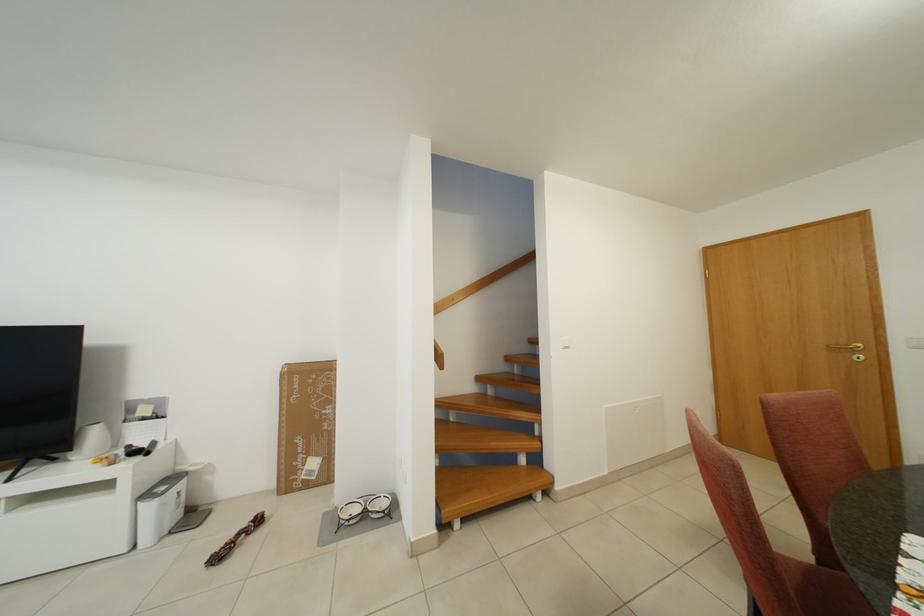
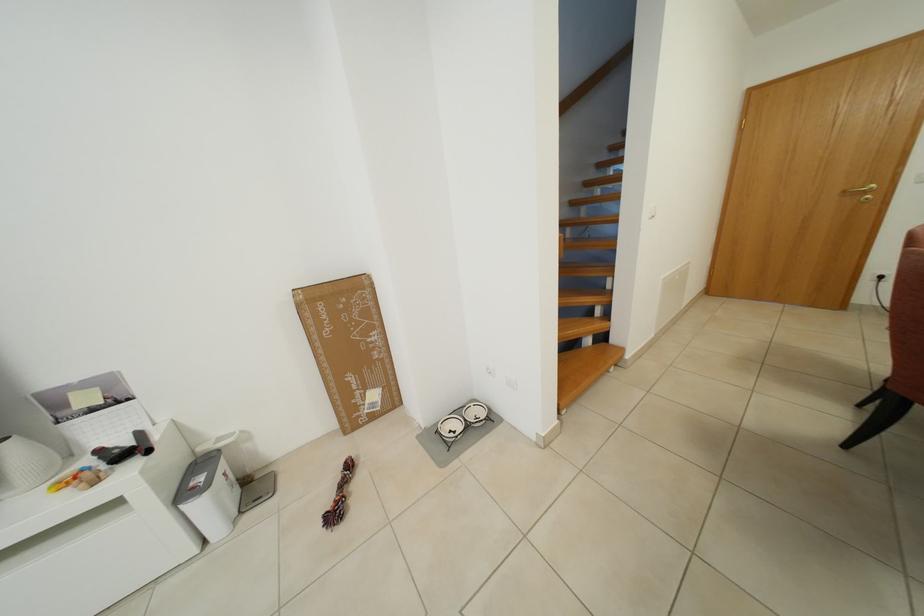
In the second image, find the point that corresponds to (171,493) in the first image.

(208, 484)